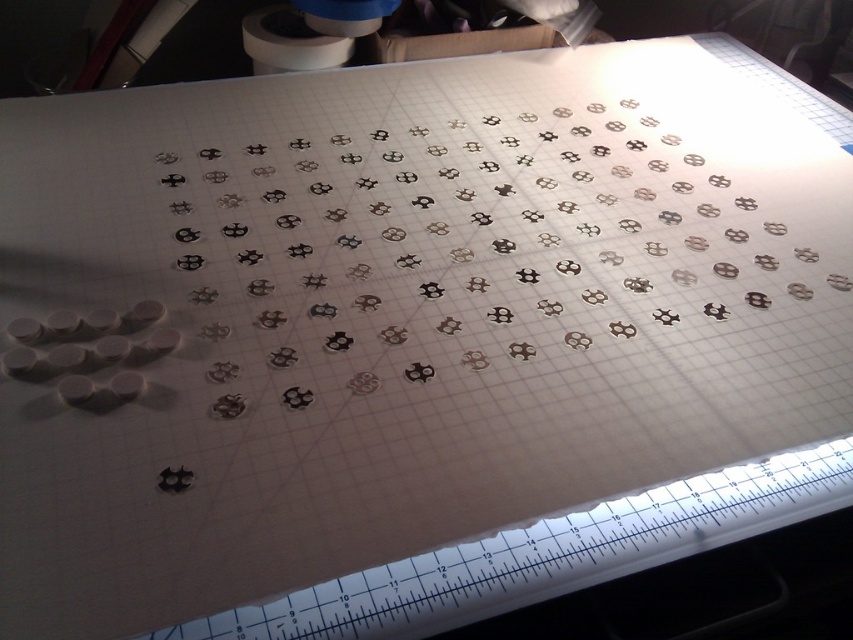
From the picture: You are looking at the grid layout and need to determine the relative positions of two points. Which point, point (831,468) or point (294,70), is closer to you?

Point (831,468) is closer to the viewer than point (294,70).

You are organizing items on a desk and need to place a new object between the white plastic ruler at bottom and the white matte toilet paper at upper center. Which item should be placed closer to the ruler?

The white plastic ruler at bottom is positioned under the white matte toilet paper at upper center, so placing the new object closer to the ruler would mean positioning it between the ruler and the toilet paper, nearer to the ruler.